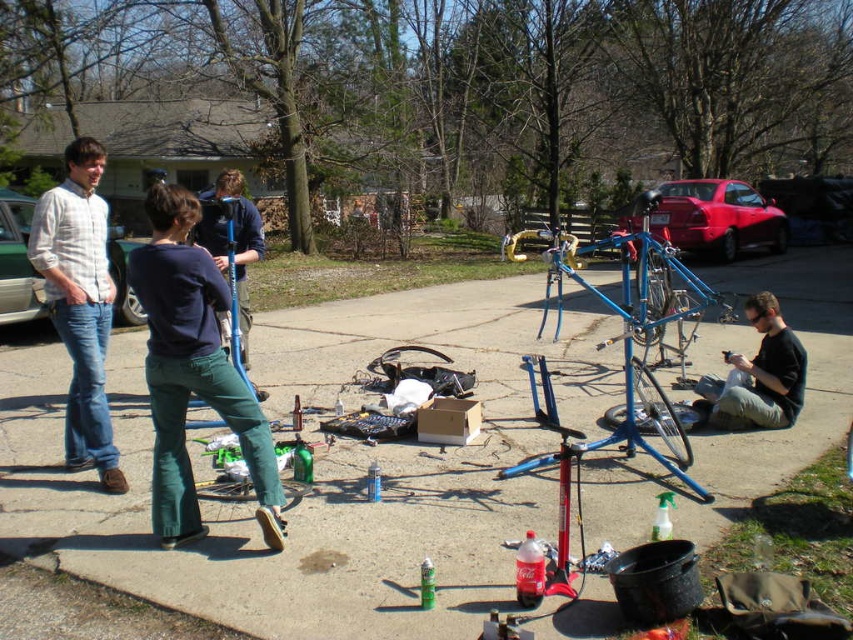
Is smooth concrete pavement at center shorter than light brown plaid shirt at left?

Incorrect, smooth concrete pavement at center's height does not fall short of light brown plaid shirt at left's.

Who is more distant from viewer, (138, 515) or (33, 237)?

The point (33, 237) is behind.

Does point (550, 435) come closer to viewer compared to point (82, 445)?

No, it is not.

Identify the location of smooth concrete pavement at center. (321, 472).

Between point (251, 404) and point (51, 269), which one is positioned in front?

Point (251, 404) is in front.

Where is `dark blue shirt at center`? dark blue shirt at center is located at coordinates (193, 371).

Can you confirm if dark blue shirt at center is positioned below black matte shirt at center?

No, dark blue shirt at center is not below black matte shirt at center.

Can you confirm if dark blue shirt at center is bigger than black matte shirt at center?

Yes, dark blue shirt at center is bigger than black matte shirt at center.

Between point (195, 355) and point (721, 394), which one is positioned behind?

Point (721, 394)

Where is `dark blue shirt at center`? The image size is (853, 640). dark blue shirt at center is located at coordinates (193, 371).